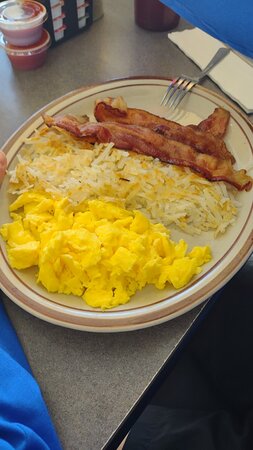
Identify the location of grey granite table top. This screenshot has width=253, height=450. (68, 372), (113, 36).